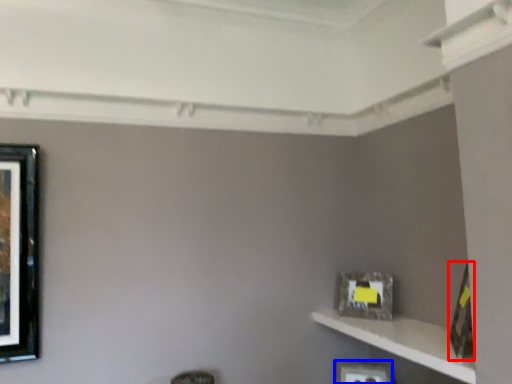
Question: Which object is closer to the camera taking this photo, picture frame (highlighted by a red box) or picture frame (highlighted by a blue box)?

Choices:
 (A) picture frame
 (B) picture frame

Answer: (A)